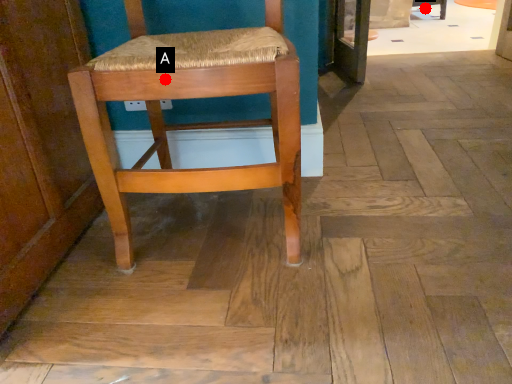
Question: Two points are circled on the image, labeled by A and B beside each circle. Which point is farther to the camera?

Choices:
 (A) A is further
 (B) B is further

Answer: (B)